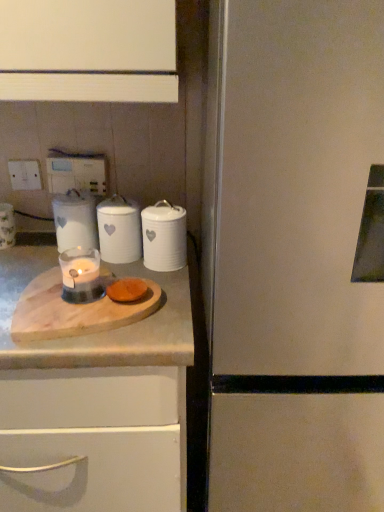
Question: Would you say white ceramic canister at center, the second kitchen appliance viewed from the right, is to the left or to the right of white ceramic candle at center, the third kitchen appliance when ordered from right to left, in the picture?

Choices:
 (A) left
 (B) right

Answer: (B)

Question: From a real-world perspective, is white ceramic canister at center, which appears as the 2th kitchen appliance when viewed from the left, physically located above or below white ceramic candle at center, the third kitchen appliance when ordered from right to left?

Choices:
 (A) below
 (B) above

Answer: (A)

Question: Which of these objects is positioned farthest from the white ceramic candle at center, the third kitchen appliance when ordered from right to left?

Choices:
 (A) white plastic electric outlet at upper left, which appears as the second electric outlet when viewed from the left
 (B) white plastic electric outlet at upper left, the first electric outlet from the left
 (C) white ceramic canister at center, the second kitchen appliance viewed from the right
 (D) satin white refrigerator at right
 (E) wooden cutting board at center, the second countertop positioned from the top

Answer: (D)

Question: Estimate the real-world distances between objects in this image. Which object is closer to the wooden cutting board at center, the first countertop from the top?

Choices:
 (A) white ceramic candle at center, which is the 1th kitchen appliance from left to right
 (B) satin white refrigerator at right
 (C) translucent glass candle at center
 (D) wooden cutting board at center, arranged as the first countertop when ordered from the bottom
 (E) white plastic electric outlet at upper left, placed as the 1th electric outlet when sorted from right to left

Answer: (D)